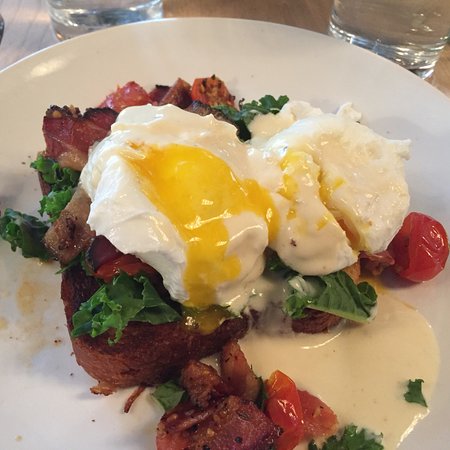
Image resolution: width=450 pixels, height=450 pixels. I want to click on plate, so click(x=339, y=83).